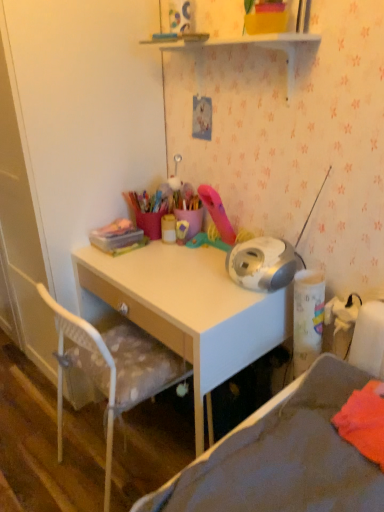
Question: Looking at the image, does white mesh chair at lower left seem bigger or smaller compared to translucent plastic container at upper left, the 1th stationery when ordered from left to right?

Choices:
 (A) big
 (B) small

Answer: (A)

Question: Is white mesh chair at lower left taller or shorter than translucent plastic container at upper left, the 1th stationery when ordered from left to right?

Choices:
 (A) tall
 (B) short

Answer: (B)

Question: Estimate the real-world distances between objects in this image. Which object is closer to the gray fabric bed at lower right?

Choices:
 (A) light wood desk at center
 (B) white glossy shelf at upper center
 (C) white mesh chair at lower left
 (D) matte yellow container at center, positioned as the 1th stationery in right-to-left order
 (E) translucent plastic container at upper left, which appears as the 2th stationery when viewed from the right

Answer: (A)

Question: Which is nearer to the light wood desk at center?

Choices:
 (A) gray fabric bed at lower right
 (B) white mesh chair at lower left
 (C) translucent plastic container at upper left, the 1th stationery when ordered from left to right
 (D) matte yellow container at center, the 2th stationery from the left
 (E) white glossy shelf at upper center

Answer: (B)